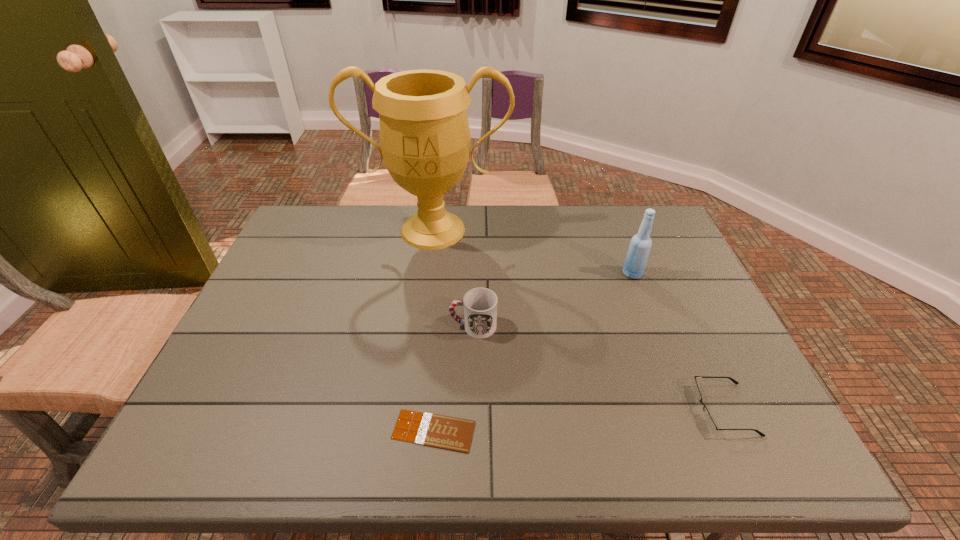
The width and height of the screenshot is (960, 540). What are the coordinates of `blank area located 0.130m on the handle side of the cup` in the screenshot? It's located at (399, 326).

The image size is (960, 540). I want to click on free space located 0.370m on the handle side of the cup, so click(x=305, y=326).

Find the location of a particular element. free point located on the handle side of the cup is located at coordinates (305, 326).

Find the location of a particular element. The height and width of the screenshot is (540, 960). free space located 0.350m on the front-facing side of the spectacles is located at coordinates (536, 409).

Image resolution: width=960 pixels, height=540 pixels. I want to click on vacant space located 0.090m on the front-facing side of the spectacles, so click(656, 409).

Find the location of a particular element. blank space located on the front-facing side of the spectacles is located at coordinates (549, 409).

Locate an element on the screen. This screenshot has width=960, height=540. vacant space located on the right of the shortest object is located at coordinates (635, 430).

Locate an element on the screen. object present at the far edge is located at coordinates (425, 139).

Image resolution: width=960 pixels, height=540 pixels. Find the location of `spectacles positioned at the near edge`. spectacles positioned at the near edge is located at coordinates (709, 422).

Identify the location of chocolate bar located in the near edge section of the desktop. The height and width of the screenshot is (540, 960). (445, 432).